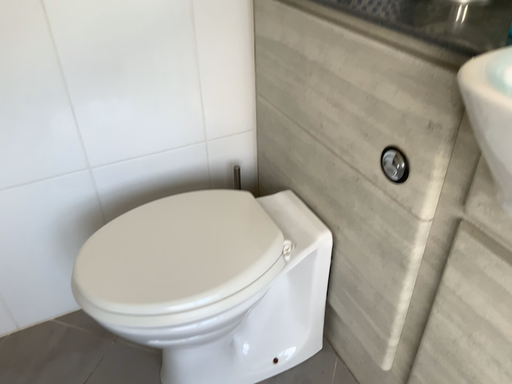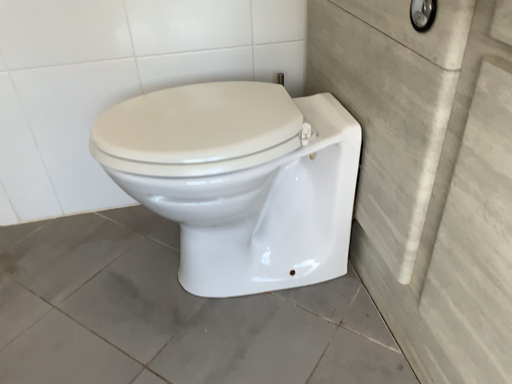
Question: Which way did the camera rotate in the video?

Choices:
 (A) rotated right
 (B) rotated left

Answer: (B)